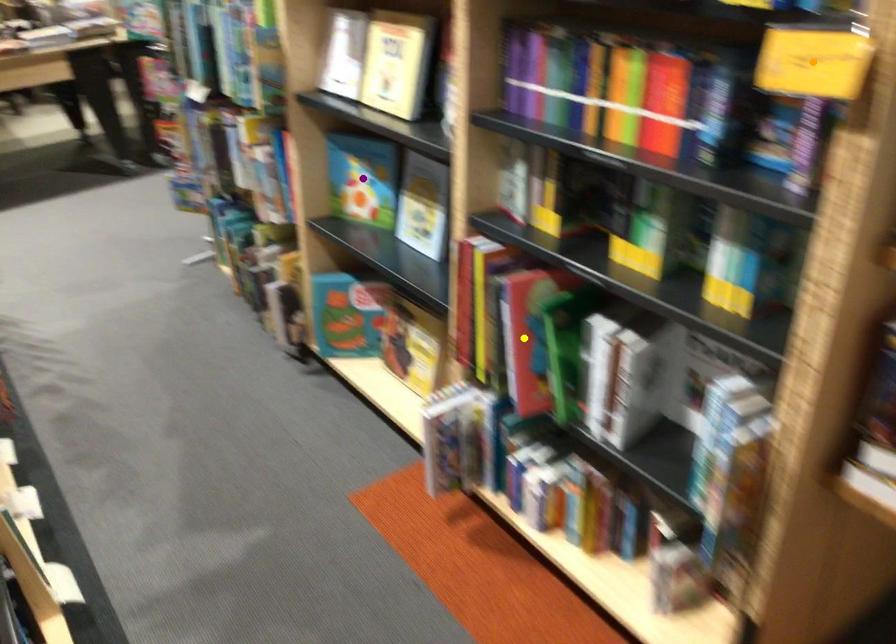
Order these from nearest to farthest:
purple point | yellow point | orange point

orange point, yellow point, purple point